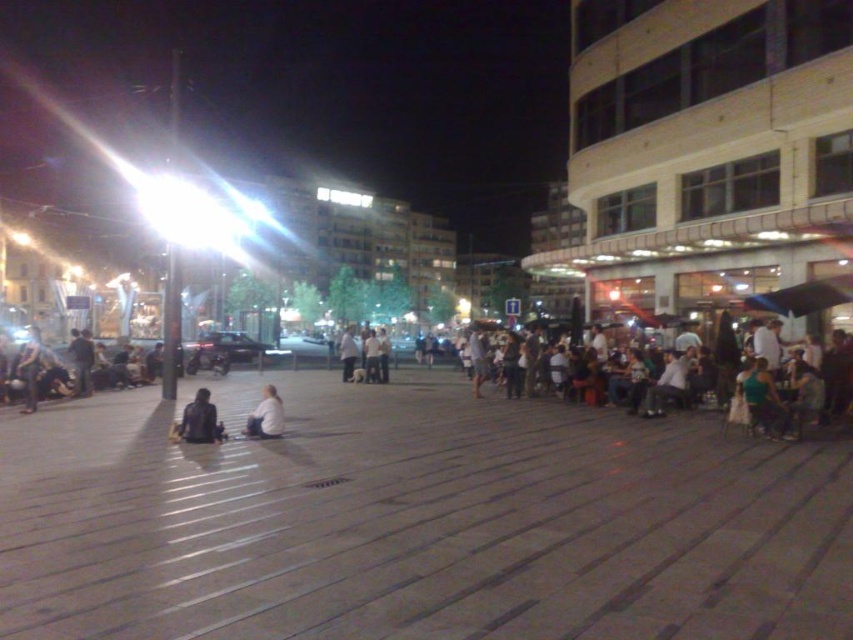
Is dark blue jacket at lower left further to the viewer compared to white matte shirt at lower center?

No, it is not.

What do you see at coordinates (199, 420) in the screenshot?
I see `dark blue jacket at lower left` at bounding box center [199, 420].

Where is `dark blue jacket at lower left`? dark blue jacket at lower left is located at coordinates (199, 420).